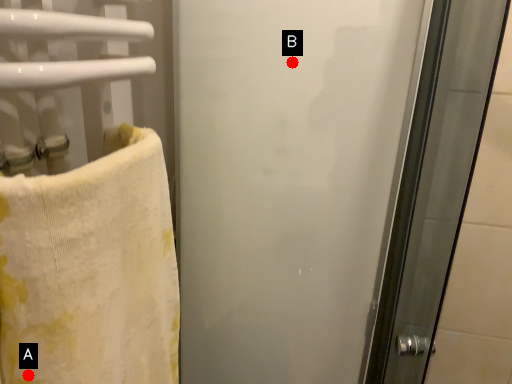
Question: Two points are circled on the image, labeled by A and B beside each circle. Which point is farther to the camera?

Choices:
 (A) A is further
 (B) B is further

Answer: (B)